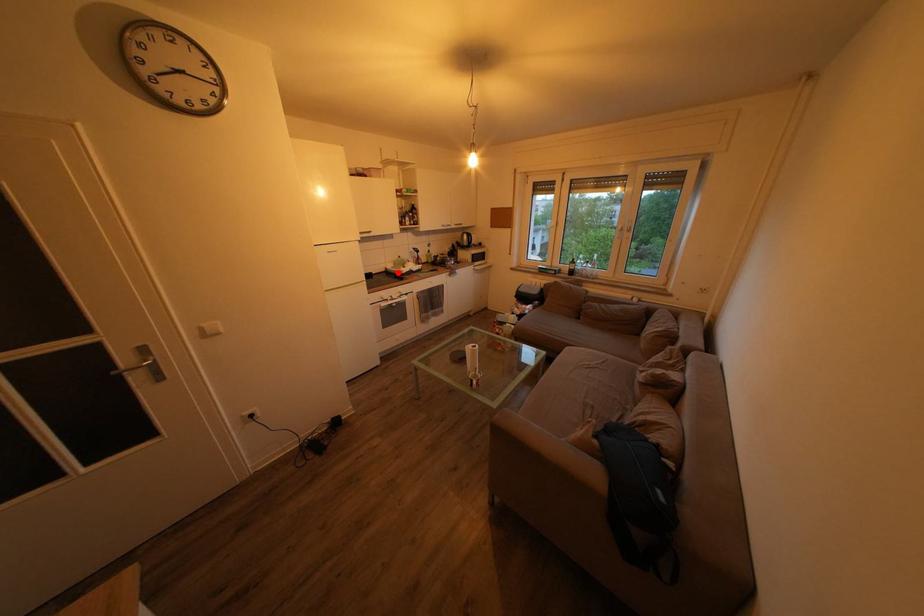
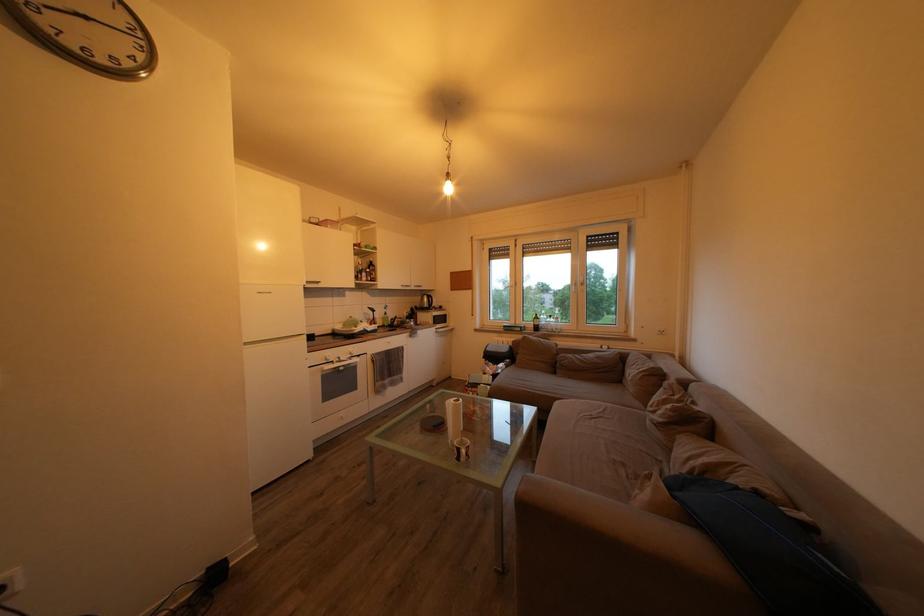
The point at the highlighted location is marked in the first image. Where is the corresponding point in the second image?

(346, 333)